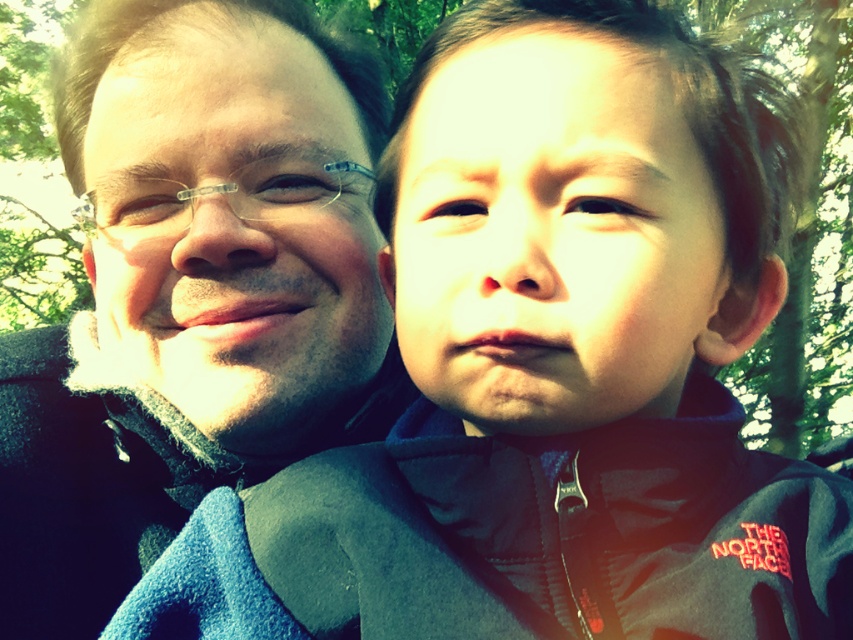
Question: Which object is closer to the camera taking this photo?

Choices:
 (A) smooth skin face at center
 (B) matte black glasses at left
 (C) matte black jacket at left

Answer: (A)

Question: Which of the following is the closest to the observer?

Choices:
 (A) (521, 13)
 (B) (550, 49)
 (C) (119, 177)

Answer: (B)

Question: Where is matte black jacket at left located in relation to matte black glasses at left in the image?

Choices:
 (A) left
 (B) right

Answer: (A)

Question: Is dark gray fleece jacket at right bigger than matte black jacket at left?

Choices:
 (A) yes
 (B) no

Answer: (B)

Question: Is dark gray fleece jacket at right thinner than matte black jacket at left?

Choices:
 (A) yes
 (B) no

Answer: (A)

Question: Considering the real-world distances, which object is farthest from the dark gray fleece jacket at right?

Choices:
 (A) matte black glasses at left
 (B) smooth skin face at center

Answer: (A)